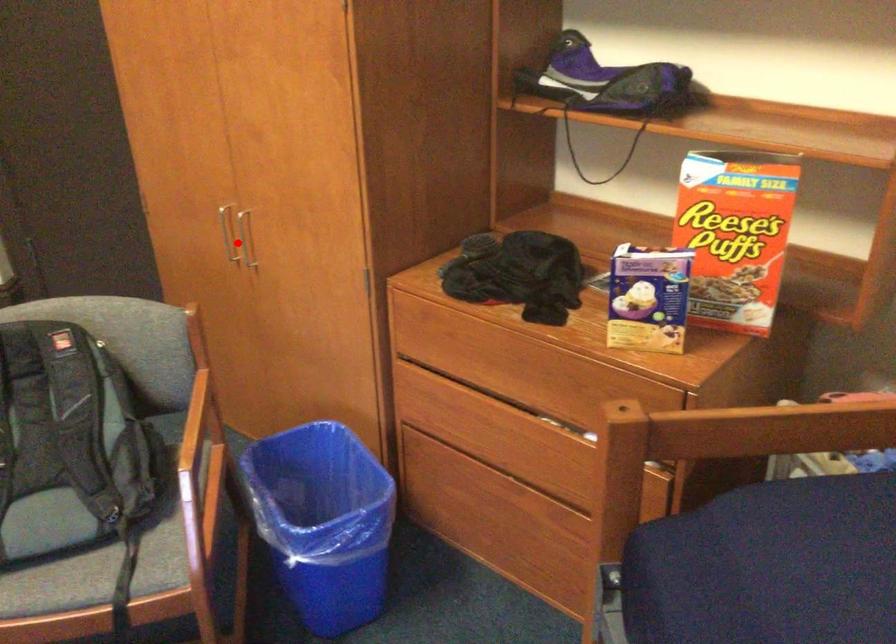
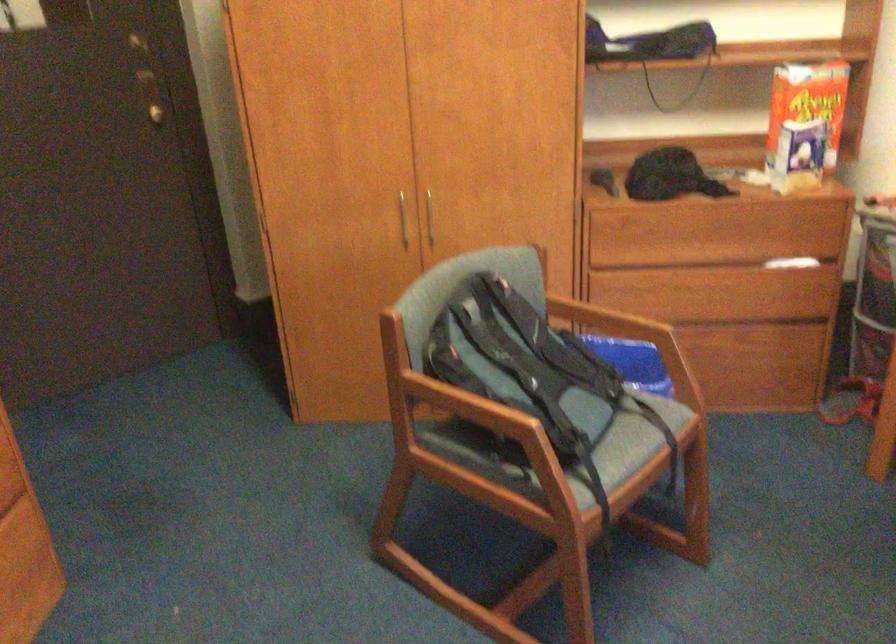
Find the pixel in the second image that matches the highlighted location in the first image.

(402, 220)